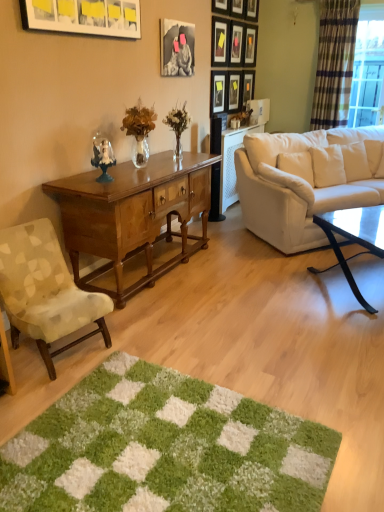
The width and height of the screenshot is (384, 512). What do you see at coordinates (45, 291) in the screenshot?
I see `beige fabric chair at lower left` at bounding box center [45, 291].

Measure the distance between point (x=378, y=213) and camera.

Point (x=378, y=213) is 3.02 meters from camera.

The image size is (384, 512). What do you see at coordinates (307, 181) in the screenshot? I see `white fabric couch at right` at bounding box center [307, 181].

Locate an element on the screen. This screenshot has width=384, height=512. matte black picture frame at upper center, acting as the 8th picture frame starting from the left is located at coordinates (236, 42).

I want to click on wooden picture frame at upper center, which is the fifth picture frame in right-to-left order, so click(x=237, y=8).

From the image's perspective, starting from the wooden picture frame at upper center, placed as the 2th picture frame when sorted from right to left, which picture frame is the 2nd one above? Please provide its 2D coordinates.

[(236, 42)]

Between matte black picture frame at upper center, acting as the 8th picture frame starting from the left, and wooden picture frame at upper center, which ranks as the tenth picture frame in left-to-right order, which one has larger size?

Answer: With larger size is matte black picture frame at upper center, acting as the 8th picture frame starting from the left.

Considering the relative positions of matte black picture frame at upper center, acting as the 8th picture frame starting from the left, and wooden picture frame at upper center, placed as the 2th picture frame when sorted from right to left, in the image provided, is matte black picture frame at upper center, acting as the 8th picture frame starting from the left, behind wooden picture frame at upper center, placed as the 2th picture frame when sorted from right to left,?

No, it is in front of wooden picture frame at upper center, placed as the 2th picture frame when sorted from right to left.

Is matte black picture frame at upper center, acting as the 8th picture frame starting from the left, wider or thinner than wooden picture frame at upper center, placed as the 2th picture frame when sorted from right to left?

Considering their sizes, matte black picture frame at upper center, acting as the 8th picture frame starting from the left, looks broader than wooden picture frame at upper center, placed as the 2th picture frame when sorted from right to left.

Can you confirm if matte black picture frame at upper center, which is the 9th picture frame from right to left, is bigger than beige fabric chair at lower left?

Incorrect, matte black picture frame at upper center, which is the 9th picture frame from right to left, is not larger than beige fabric chair at lower left.

Is matte black picture frame at upper center, which is counted as the 3th picture frame, starting from the left, positioned beyond the bounds of beige fabric chair at lower left?

matte black picture frame at upper center, which is counted as the 3th picture frame, starting from the left, is positioned outside beige fabric chair at lower left.

Are matte black picture frame at upper center, which is counted as the 3th picture frame, starting from the left, and beige fabric chair at lower left beside each other?

There is a gap between matte black picture frame at upper center, which is counted as the 3th picture frame, starting from the left, and beige fabric chair at lower left.

Is matte black picture frame at upper center, which is the 9th picture frame from right to left, to the left or to the right of beige fabric chair at lower left in the image?

matte black picture frame at upper center, which is the 9th picture frame from right to left, is to the right of beige fabric chair at lower left.

Is white fabric couch at right situated inside black metal coffee table at lower right or outside?

white fabric couch at right is located beyond the bounds of black metal coffee table at lower right.

Can you tell me how much white fabric couch at right and black metal coffee table at lower right differ in facing direction?

4.72 degrees.

Based on the photo, is white fabric couch at right positioned behind black metal coffee table at lower right?

Yes, white fabric couch at right is further from the viewer.

From a real-world perspective, between white fabric couch at right and black metal coffee table at lower right, who is vertically higher?

In real-world perspective, white fabric couch at right is above.

Looking at this image, is wooden picture frame at upper center, the 8th picture frame when ordered from right to left, inside the boundaries of wooden picture frame at upper center, which ranks as the tenth picture frame in left-to-right order, or outside?

wooden picture frame at upper center, the 8th picture frame when ordered from right to left, is outside wooden picture frame at upper center, which ranks as the tenth picture frame in left-to-right order.

Which is behind, point (214, 49) or point (245, 89)?

Positioned behind is point (245, 89).

Is wooden picture frame at upper center, the 8th picture frame when ordered from right to left, closer to camera compared to wooden picture frame at upper center, placed as the 2th picture frame when sorted from right to left?

Yes, wooden picture frame at upper center, the 8th picture frame when ordered from right to left, is closer to the camera.

From the image's perspective, is wooden picture frame at upper center, the 8th picture frame when ordered from right to left, over wooden picture frame at upper center, placed as the 2th picture frame when sorted from right to left?

Yes.

Who is bigger, wooden picture frame at upper center, arranged as the 7th picture frame when viewed from the right, or matte black picture frame at upper center, which ranks as the 1th picture frame in right-to-left order?

matte black picture frame at upper center, which ranks as the 1th picture frame in right-to-left order.

From the image's perspective, who appears lower, wooden picture frame at upper center, acting as the fifth picture frame starting from the left, or matte black picture frame at upper center, which ranks as the 1th picture frame in right-to-left order?

matte black picture frame at upper center, which ranks as the 1th picture frame in right-to-left order, from the image's perspective.

From a real-world perspective, which is physically above, wooden picture frame at upper center, acting as the fifth picture frame starting from the left, or matte black picture frame at upper center, which ranks as the 1th picture frame in right-to-left order?

wooden picture frame at upper center, acting as the fifth picture frame starting from the left, is physically above.

Are wooden picture frame at upper center, arranged as the 7th picture frame when viewed from the right, and matte black picture frame at upper center, the eleventh picture frame viewed from the left, beside each other?

wooden picture frame at upper center, arranged as the 7th picture frame when viewed from the right, and matte black picture frame at upper center, the eleventh picture frame viewed from the left, are clearly separated.

Is green shaggy rug at lower center facing towards wooden picture frame at upper center, which ranks as the tenth picture frame in left-to-right order?

No, green shaggy rug at lower center does not turn towards wooden picture frame at upper center, which ranks as the tenth picture frame in left-to-right order.

From the image's perspective, is green shaggy rug at lower center above wooden picture frame at upper center, placed as the 2th picture frame when sorted from right to left?

Actually, green shaggy rug at lower center appears below wooden picture frame at upper center, placed as the 2th picture frame when sorted from right to left, in the image.

Considering the relative sizes of green shaggy rug at lower center and wooden picture frame at upper center, which ranks as the tenth picture frame in left-to-right order, in the image provided, is green shaggy rug at lower center bigger than wooden picture frame at upper center, which ranks as the tenth picture frame in left-to-right order,?

Correct, green shaggy rug at lower center is larger in size than wooden picture frame at upper center, which ranks as the tenth picture frame in left-to-right order.

Is the depth of green shaggy rug at lower center less than that of wooden picture frame at upper center, which ranks as the tenth picture frame in left-to-right order?

Yes, it is.

Is wooden picture frame at upper center, the 8th picture frame when ordered from right to left, completely or partially inside wooden picture frame at upper center, which is the third picture frame from right to left?

No.

Is wooden picture frame at upper center, which is the third picture frame from right to left, far away from wooden picture frame at upper center, the 8th picture frame when ordered from right to left?

wooden picture frame at upper center, which is the third picture frame from right to left, is near wooden picture frame at upper center, the 8th picture frame when ordered from right to left, not far away.

Locate an element on the screen. The image size is (384, 512). picture frame that is the 5th one when counting backward from the wooden picture frame at upper center, marked as the fourth picture frame in a left-to-right arrangement is located at coordinates (252, 10).

From the image's perspective, between wooden picture frame at upper center, placed as the ninth picture frame when sorted from left to right, and wooden picture frame at upper center, the 8th picture frame when ordered from right to left, who is located below?

wooden picture frame at upper center, the 8th picture frame when ordered from right to left, appears lower in the image.

Where is `the 2nd picture frame above the wooden picture frame at upper center, which ranks as the tenth picture frame in left-to-right order (from the image's perspective)`? The image size is (384, 512). the 2nd picture frame above the wooden picture frame at upper center, which ranks as the tenth picture frame in left-to-right order (from the image's perspective) is located at coordinates (236, 42).

Where is `chair below the matte black picture frame at upper center, which is counted as the 3th picture frame, starting from the left (from a real-world perspective)`? This screenshot has width=384, height=512. chair below the matte black picture frame at upper center, which is counted as the 3th picture frame, starting from the left (from a real-world perspective) is located at coordinates (45, 291).

Consider the image. Which object lies further to the anchor point wooden picture frame at upper center, arranged as the 7th picture frame when viewed from the right, plaid fabric curtain at right or matte black picture frame at upper center, positioned as the second picture frame in left-to-right order?

The object further to wooden picture frame at upper center, arranged as the 7th picture frame when viewed from the right, is plaid fabric curtain at right.

Estimate the real-world distances between objects in this image. Which object is closer to wooden picture frame at upper center, the sixth picture frame positioned from the right, wooden picture frame at upper center, marked as the fourth picture frame in a left-to-right arrangement, or wooden picture frame at upper center, acting as the fifth picture frame starting from the left?

wooden picture frame at upper center, marked as the fourth picture frame in a left-to-right arrangement, lies closer to wooden picture frame at upper center, the sixth picture frame positioned from the right, than the other object.

When comparing their distances from matte white picture frame at upper left, the 1th picture frame from the left, does beige fabric chair at lower left or matte black picture frame at upper center, which ranks as the 1th picture frame in right-to-left order, seem further?

The object further to matte white picture frame at upper left, the 1th picture frame from the left, is matte black picture frame at upper center, which ranks as the 1th picture frame in right-to-left order.

From the image, which object appears to be nearer to matte black picture frame at upper center, acting as the 8th picture frame starting from the left, wooden picture frame at upper center, acting as the fifth picture frame starting from the left, or wooden picture frame at upper center, placed as the seventh picture frame when sorted from left to right?

wooden picture frame at upper center, placed as the seventh picture frame when sorted from left to right.

When comparing their distances from white fabric couch at right, does green shaggy rug at lower center or wooden picture frame at upper center, marked as the fourth picture frame in a left-to-right arrangement, seem further?

green shaggy rug at lower center lies further to white fabric couch at right than the other object.

Considering their positions, is black metal coffee table at lower right positioned further to wooden picture frame at upper center, arranged as the 7th picture frame when viewed from the right, than matte black picture frame at upper center, arranged as the 4th picture frame when viewed from the right?

black metal coffee table at lower right is positioned further to the anchor wooden picture frame at upper center, arranged as the 7th picture frame when viewed from the right.

When comparing their distances from matte black picture frame at upper center, which is counted as the 3th picture frame, starting from the left, does wooden picture frame at upper center, marked as the fourth picture frame in a left-to-right arrangement, or wooden picture frame at upper center, arranged as the 7th picture frame when viewed from the right, seem further?

Based on the image, wooden picture frame at upper center, arranged as the 7th picture frame when viewed from the right, appears to be further to matte black picture frame at upper center, which is counted as the 3th picture frame, starting from the left.

Considering their positions, is matte black picture frame at upper center, which appears as the 10th picture frame when viewed from the right, positioned further to wooden picture frame at upper center, the sixth picture frame positioned from the right, than matte black picture frame at upper center, which is the 9th picture frame from right to left?

Based on the image, matte black picture frame at upper center, which appears as the 10th picture frame when viewed from the right, appears to be further to wooden picture frame at upper center, the sixth picture frame positioned from the right.

You are a GUI agent. You are given a task and a screenshot of the screen. Output one action in this format:
    pyautogui.click(x=<x>, y=<y>)
    Task: Click on the desk between matte white picture frame at upper left, the eleventh picture frame when ordered from right to left, and black metal coffee table at lower right
    This screenshot has width=384, height=512.
    Given the screenshot: What is the action you would take?
    pyautogui.click(x=133, y=215)

Locate an element on the screen. studio couch between wooden picture frame at upper center, which is the fifth picture frame in right-to-left order, and black metal coffee table at lower right, in the vertical direction is located at coordinates (307, 181).

Where is `coffee table located between matte white picture frame at upper left, the 1th picture frame from the left, and wooden picture frame at upper center, the sixth picture frame positioned from the right, in the depth direction`? The width and height of the screenshot is (384, 512). coffee table located between matte white picture frame at upper left, the 1th picture frame from the left, and wooden picture frame at upper center, the sixth picture frame positioned from the right, in the depth direction is located at coordinates (355, 237).

Where is `studio couch between wooden picture frame at upper center, acting as the fifth picture frame starting from the left, and green shaggy rug at lower center vertically`? This screenshot has height=512, width=384. studio couch between wooden picture frame at upper center, acting as the fifth picture frame starting from the left, and green shaggy rug at lower center vertically is located at coordinates (307, 181).